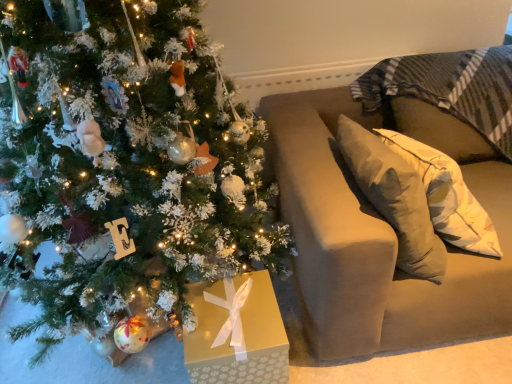
In order to face white frosted christmas tree at left, should I rotate leftwards or rightwards?

A 18.110 degree turn to the left will do.

The height and width of the screenshot is (384, 512). I want to click on white frosted christmas tree at left, so click(x=125, y=162).

Measure the distance between point (x=39, y=100) and camera.

They are 3.57 feet apart.

What do you see at coordinates (125, 162) in the screenshot? I see `white frosted christmas tree at left` at bounding box center [125, 162].

What is the approximate width of velvet beige sofa at right?

velvet beige sofa at right is 1.16 meters wide.

Find the location of a particular element. Image resolution: width=512 pixels, height=384 pixels. velvet beige sofa at right is located at coordinates (381, 233).

What do you see at coordinates (381, 233) in the screenshot? I see `velvet beige sofa at right` at bounding box center [381, 233].

Locate an element on the screen. white frosted christmas tree at left is located at coordinates [x=125, y=162].

Between velvet beige sofa at right and white frosted christmas tree at left, which one appears on the right side from the viewer's perspective?

Positioned to the right is velvet beige sofa at right.

Relative to white frosted christmas tree at left, is velvet beige sofa at right in front or behind?

velvet beige sofa at right is positioned farther from the viewer than white frosted christmas tree at left.

Is point (267, 115) positioned before point (4, 118)?

No, it is not.

From the image's perspective, which object appears higher, velvet beige sofa at right or white frosted christmas tree at left?

white frosted christmas tree at left.

From a real-world perspective, is velvet beige sofa at right located higher than white frosted christmas tree at left?

No, from a real-world perspective, velvet beige sofa at right is not on top of white frosted christmas tree at left.

Between velvet beige sofa at right and white frosted christmas tree at left, which one has larger width?

Wider between the two is white frosted christmas tree at left.

From the picture: Is velvet beige sofa at right taller or shorter than white frosted christmas tree at left?

velvet beige sofa at right is shorter than white frosted christmas tree at left.

Which of these two, velvet beige sofa at right or white frosted christmas tree at left, is bigger?

white frosted christmas tree at left is bigger.

In the scene shown: Is velvet beige sofa at right not inside white frosted christmas tree at left?

That's correct, velvet beige sofa at right is outside of white frosted christmas tree at left.

Is velvet beige sofa at right not close to white frosted christmas tree at left?

No, velvet beige sofa at right is not far from white frosted christmas tree at left.

Is white frosted christmas tree at left at the back of velvet beige sofa at right?

No, velvet beige sofa at right's orientation is not away from white frosted christmas tree at left.

Can you tell me how much velvet beige sofa at right and white frosted christmas tree at left differ in facing direction?

They differ by 1.16 degrees in their facing directions.

Looking at this image, how distant is velvet beige sofa at right from white frosted christmas tree at left?

velvet beige sofa at right is 20.22 inches away from white frosted christmas tree at left.

Find the location of `christmas tree above the velvet beige sofa at right (from a real-world perspective)`. christmas tree above the velvet beige sofa at right (from a real-world perspective) is located at coordinates (125, 162).

Does white frosted christmas tree at left appear on the right side of velvet beige sofa at right?

In fact, white frosted christmas tree at left is to the left of velvet beige sofa at right.

Is white frosted christmas tree at left in front of velvet beige sofa at right?

That is True.

Which is in front, point (122, 80) or point (464, 316)?

The point (122, 80) is closer.

From the image's perspective, is white frosted christmas tree at left located above or below velvet beige sofa at right?

white frosted christmas tree at left is above velvet beige sofa at right.

From a real-world perspective, does white frosted christmas tree at left sit lower than velvet beige sofa at right?

No, from a real-world perspective, white frosted christmas tree at left is not beneath velvet beige sofa at right.

In the scene shown: Is white frosted christmas tree at left thinner than velvet beige sofa at right?

In fact, white frosted christmas tree at left might be wider than velvet beige sofa at right.

Who is taller, white frosted christmas tree at left or velvet beige sofa at right?

Standing taller between the two is white frosted christmas tree at left.

Based on their sizes in the image, would you say white frosted christmas tree at left is bigger or smaller than velvet beige sofa at right?

Considering their sizes, white frosted christmas tree at left takes up more space than velvet beige sofa at right.

Based on the photo, is white frosted christmas tree at left not within velvet beige sofa at right?

Absolutely, white frosted christmas tree at left is external to velvet beige sofa at right.

Would you say white frosted christmas tree at left is a long distance from velvet beige sofa at right?

They are positioned close to each other.

Is white frosted christmas tree at left oriented away from velvet beige sofa at right?

No, velvet beige sofa at right is not at the back of white frosted christmas tree at left.

How many degrees apart are the facing directions of white frosted christmas tree at left and velvet beige sofa at right?

1.16 degrees separate the facing orientations of white frosted christmas tree at left and velvet beige sofa at right.

I want to click on christmas tree in front of the velvet beige sofa at right, so click(x=125, y=162).

You are a GUI agent. You are given a task and a screenshot of the screen. Output one action in this format:
    pyautogui.click(x=<x>, y=<y>)
    Task: Click on the christmas tree that appears on the left of velvet beige sofa at right
    Image resolution: width=512 pixels, height=384 pixels.
    Given the screenshot: What is the action you would take?
    pyautogui.click(x=125, y=162)

Locate an element on the screen. christmas tree that appears in front of the velvet beige sofa at right is located at coordinates (125, 162).